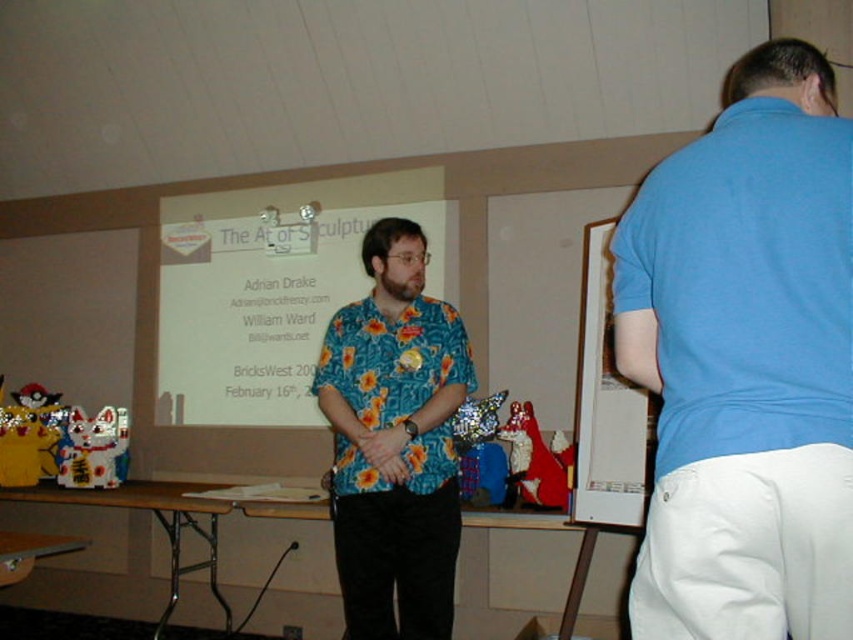
You are an attendee at the event and want to approach the speaker wearing the floral fabric shirt at center. However, there is a person in a blue cotton shirt at upper right blocking your path. Can you walk around them to reach the speaker?

The blue cotton shirt at upper right is in front of the floral fabric shirt at center, so you can walk around the blue cotton shirt at upper right to reach the speaker wearing the floral fabric shirt at center.

You are an event organizer who needs to arrange seating for attendees in the conference room. The floral fabric shirt at center is the presenter, and the blue cotton shirt at upper right is an assistant. Which of the two has a narrower torso, making them easier to seat in tighter spaces?

The blue cotton shirt at upper right has a lesser width compared to the floral fabric shirt at center, so the assistant wearing the blue cotton shirt at upper right has a narrower torso and would be easier to seat in tighter spaces.